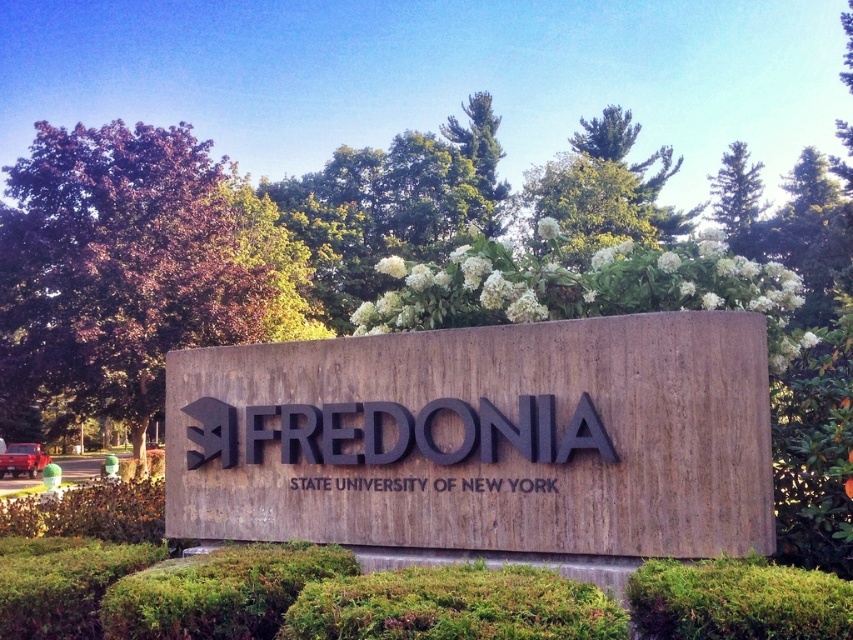
Based on the photo, can you confirm if black concrete sign at center is positioned above black matte sign at center?

Incorrect, black concrete sign at center is not positioned above black matte sign at center.

Locate an element on the screen. The height and width of the screenshot is (640, 853). black concrete sign at center is located at coordinates (482, 438).